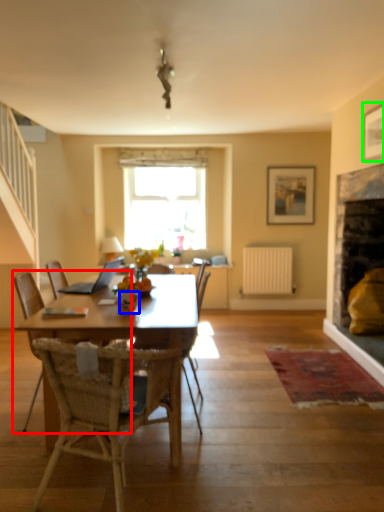
Question: Which object is positioned farthest from chair (highlighted by a red box)? Select from vase (highlighted by a blue box) and picture frame (highlighted by a green box).

Choices:
 (A) vase
 (B) picture frame

Answer: (B)